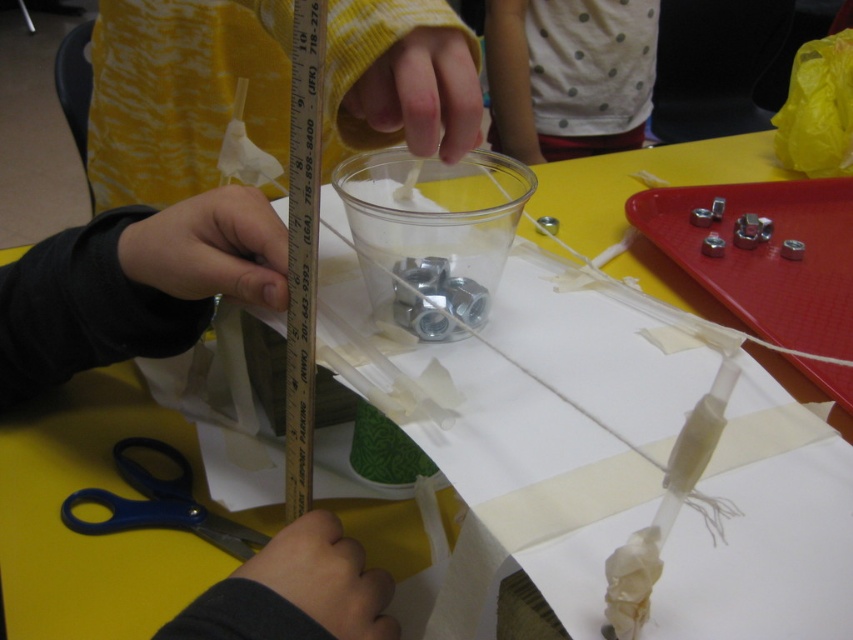
Between black matte ruler at upper center and yellow/yellowish fabric at upper center, which one is positioned lower?

Positioned lower is black matte ruler at upper center.

Is point (122, 352) in front of point (329, 108)?

No, (122, 352) is behind (329, 108).

Is point (128, 294) positioned before point (178, 10)?

Yes, point (128, 294) is closer to viewer.

This screenshot has height=640, width=853. In order to click on black matte ruler at upper center in this screenshot , I will do `click(134, 285)`.

Which of these two, black matte ruler at upper center or blue plastic scissors at lower left, stands shorter?

With less height is blue plastic scissors at lower left.

Can you confirm if black matte ruler at upper center is positioned to the left of blue plastic scissors at lower left?

Incorrect, black matte ruler at upper center is not on the left side of blue plastic scissors at lower left.

Where is `black matte ruler at upper center`? black matte ruler at upper center is located at coordinates (134, 285).

Where is `black matte ruler at upper center`? This screenshot has height=640, width=853. black matte ruler at upper center is located at coordinates (134, 285).

Can you confirm if yellow/yellowish fabric at upper center is bigger than blue plastic scissors at lower left?

Yes, yellow/yellowish fabric at upper center is bigger than blue plastic scissors at lower left.

This screenshot has height=640, width=853. I want to click on yellow/yellowish fabric at upper center, so click(181, 92).

Find the location of a particular element. yellow/yellowish fabric at upper center is located at coordinates (181, 92).